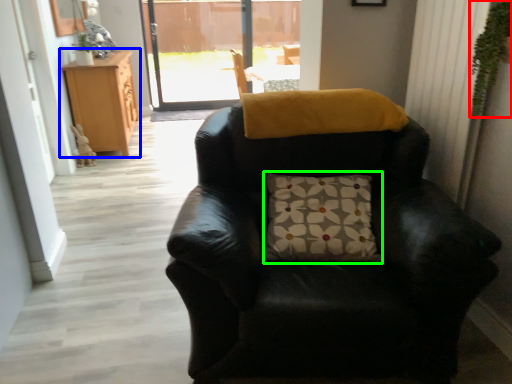
Question: Considering the real-world distances, which object is closest to plant (highlighted by a red box)? cabinetry (highlighted by a blue box) or pillow (highlighted by a green box).

Choices:
 (A) cabinetry
 (B) pillow

Answer: (B)